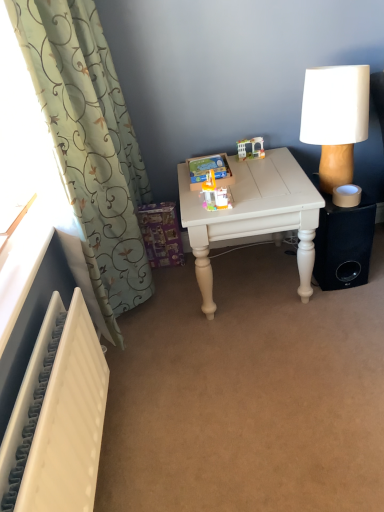
This screenshot has width=384, height=512. In order to click on vacant area on top of white painted wood table at center (from a real-world perspective) in this screenshot , I will do `click(247, 176)`.